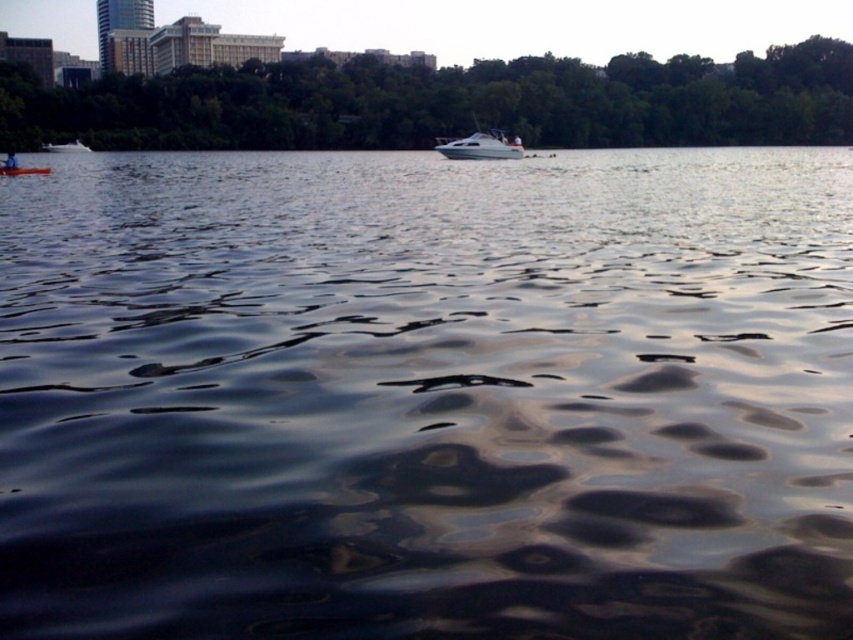
Does white glossy boat at center appear on the left side of orange plastic kayak at lower left?

In fact, white glossy boat at center is to the right of orange plastic kayak at lower left.

Image resolution: width=853 pixels, height=640 pixels. What do you see at coordinates (480, 147) in the screenshot?
I see `white glossy boat at center` at bounding box center [480, 147].

The width and height of the screenshot is (853, 640). What are the coordinates of `white glossy boat at center` in the screenshot? It's located at (480, 147).

The height and width of the screenshot is (640, 853). In order to click on white glossy boat at center in this screenshot , I will do `click(480, 147)`.

Between green leafy trees at upper center and orange plastic kayak at lower left, which one appears on the left side from the viewer's perspective?

Positioned to the left is orange plastic kayak at lower left.

Who is lower down, green leafy trees at upper center or orange plastic kayak at lower left?

Positioned lower is orange plastic kayak at lower left.

Between point (437, 84) and point (39, 170), which one is positioned in front?

Point (39, 170) is in front.

This screenshot has width=853, height=640. I want to click on green leafy trees at upper center, so click(448, 104).

Is green leafy trees at upper center shorter than white glossy boat at center?

Incorrect, green leafy trees at upper center's height does not fall short of white glossy boat at center's.

Does green leafy trees at upper center have a larger size compared to white glossy boat at center?

Yes, green leafy trees at upper center is bigger than white glossy boat at center.

Does point (815, 92) come behind point (514, 141)?

Yes, it is behind point (514, 141).

Locate an element on the screen. The height and width of the screenshot is (640, 853). green leafy trees at upper center is located at coordinates (448, 104).